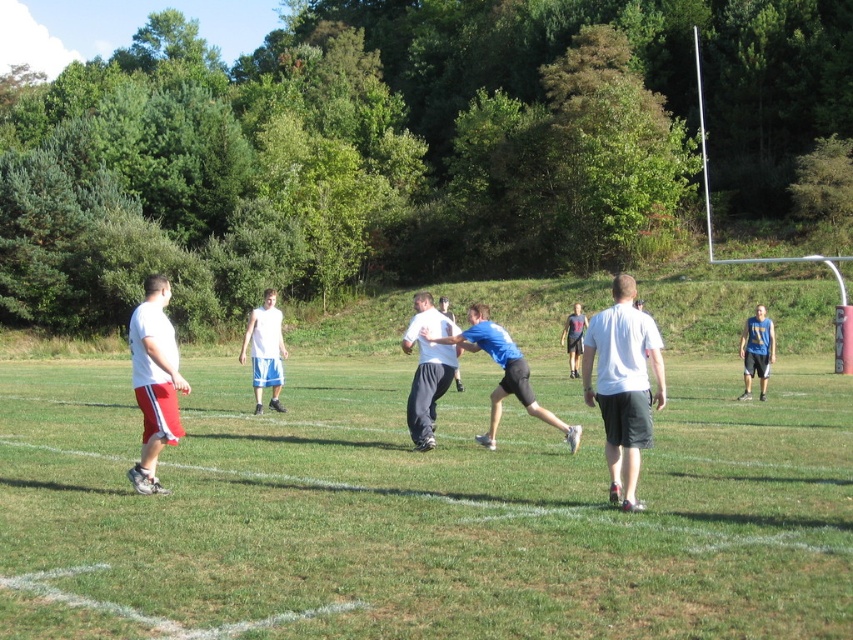
You are a photographer positioned at the center of the field. You want to capture a photo that includes the matte white shorts at left. Based on their current position, where should you aim your camera to ensure they are in the frame?

The matte white shorts at left are located at point 0.595 on the x axis and 0.182 on the y axis. To include them in the frame, aim your camera towards the lower left quadrant of the field since they are positioned near the left boundary and slightly forward from the center.

Consider the image. You are a photographer positioned at the edge of the field. You want to capture a closeup shot of the white matte shorts at center. Based on the coordinates provided, in which direction should you move your camera to focus on the subject?

The white matte shorts at center are located at coordinates point (265, 349). To focus on them, move your camera slightly to the right and upwards since the coordinates are in the center but slightly offset towards the right and upper part of the image.